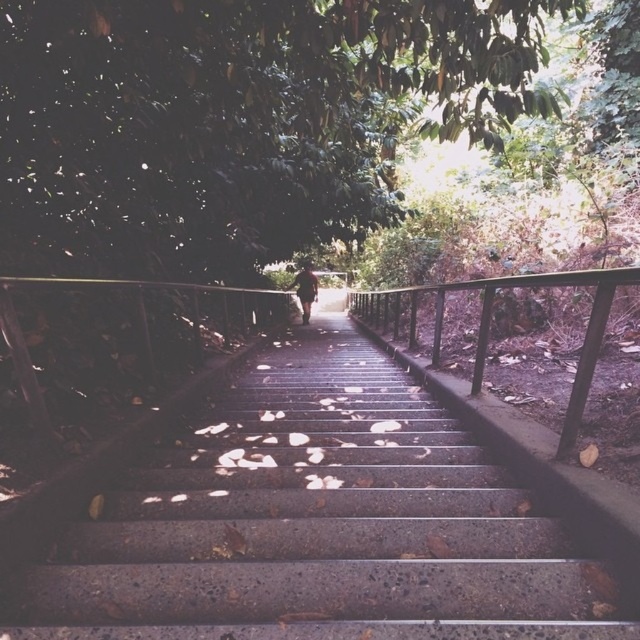
Question: Among these points, which one is farthest from the camera?

Choices:
 (A) (268, 593)
 (B) (413, 326)
 (C) (314, 296)

Answer: (C)

Question: Which of the following is the closest to the observer?

Choices:
 (A) concrete stairs at center
 (B) metallic black balustrade at center
 (C) dark brown leather jacket at center

Answer: (A)

Question: Is concrete stairs at center thinner than dark brown leather jacket at center?

Choices:
 (A) yes
 (B) no

Answer: (B)

Question: Based on their relative distances, which object is farther from the concrete stairs at center?

Choices:
 (A) metallic black balustrade at center
 (B) dark brown leather jacket at center

Answer: (B)

Question: Does metallic black balustrade at center appear on the left side of dark brown leather jacket at center?

Choices:
 (A) yes
 (B) no

Answer: (B)

Question: Is concrete stairs at center to the left of dark brown leather jacket at center from the viewer's perspective?

Choices:
 (A) yes
 (B) no

Answer: (B)